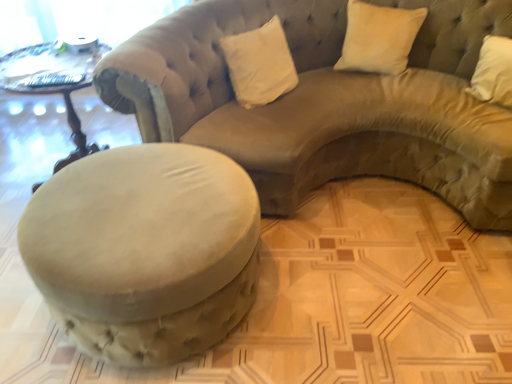
Question: In which direction should I rotate to look at white velvet pillow at upper center, placed as the first pillow when sorted from left to right?

Choices:
 (A) right
 (B) left

Answer: (A)

Question: Considering the relative sizes of wooden carved table at left and suede beige studio couch at center in the image provided, is wooden carved table at left bigger than suede beige studio couch at center?

Choices:
 (A) no
 (B) yes

Answer: (A)

Question: Does wooden carved table at left have a lesser width compared to suede beige studio couch at center?

Choices:
 (A) no
 (B) yes

Answer: (B)

Question: Does wooden carved table at left have a lesser height compared to suede beige studio couch at center?

Choices:
 (A) yes
 (B) no

Answer: (A)

Question: Is suede beige studio couch at center completely or partially inside wooden carved table at left?

Choices:
 (A) yes
 (B) no

Answer: (B)

Question: Is wooden carved table at left at the right side of suede beige studio couch at center?

Choices:
 (A) no
 (B) yes

Answer: (A)

Question: From a real-world perspective, is wooden carved table at left positioned over suede beige studio couch at center based on gravity?

Choices:
 (A) no
 (B) yes

Answer: (A)

Question: Is white velvet pillow at upper right, marked as the 2th pillow in a left-to-right arrangement, closer to the viewer compared to wooden carved table at left?

Choices:
 (A) no
 (B) yes

Answer: (A)

Question: From the image's perspective, does white velvet pillow at upper right, acting as the first pillow starting from the right, appear higher than wooden carved table at left?

Choices:
 (A) no
 (B) yes

Answer: (B)

Question: Is white velvet pillow at upper right, marked as the 2th pillow in a left-to-right arrangement, outside wooden carved table at left?

Choices:
 (A) no
 (B) yes

Answer: (B)

Question: Is white velvet pillow at upper right, acting as the first pillow starting from the right, to the left of wooden carved table at left from the viewer's perspective?

Choices:
 (A) no
 (B) yes

Answer: (A)

Question: Can you confirm if white velvet pillow at upper right, marked as the 2th pillow in a left-to-right arrangement, is bigger than wooden carved table at left?

Choices:
 (A) no
 (B) yes

Answer: (A)

Question: From a real-world perspective, is white velvet pillow at upper right, marked as the 2th pillow in a left-to-right arrangement, positioned under wooden carved table at left based on gravity?

Choices:
 (A) no
 (B) yes

Answer: (A)

Question: From a real-world perspective, does suede beige studio couch at center stand above white velvet pillow at upper right, acting as the first pillow starting from the right?

Choices:
 (A) yes
 (B) no

Answer: (B)